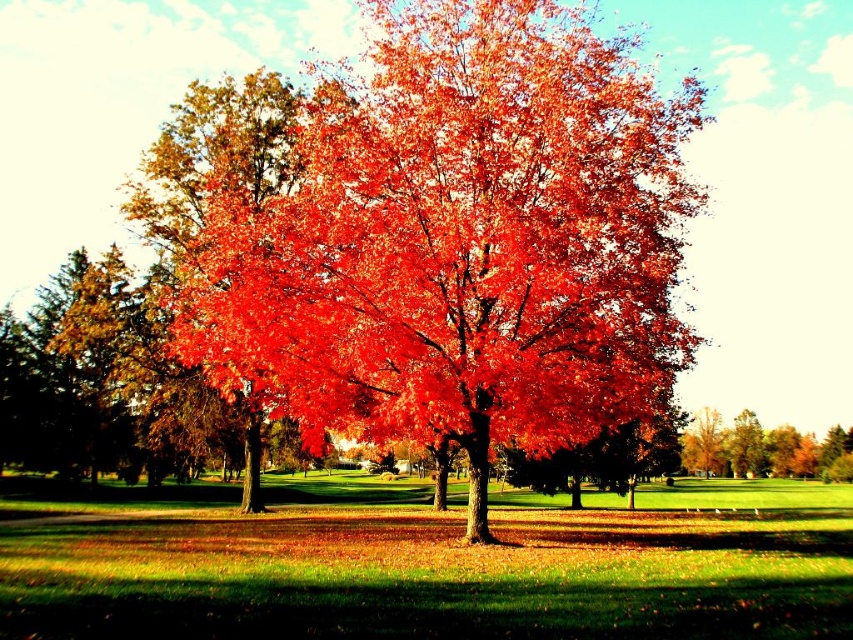
Question: Can you confirm if shiny red maple tree at center is positioned to the left of shiny orange tree at center?

Choices:
 (A) yes
 (B) no

Answer: (A)

Question: Can you confirm if shiny red maple tree at center is bigger than shiny orange tree at center?

Choices:
 (A) yes
 (B) no

Answer: (A)

Question: Which point is closer to the camera?

Choices:
 (A) (508, 36)
 (B) (693, 472)

Answer: (A)

Question: Considering the relative positions of shiny red maple tree at center and shiny orange tree at center in the image provided, where is shiny red maple tree at center located with respect to shiny orange tree at center?

Choices:
 (A) above
 (B) below

Answer: (A)